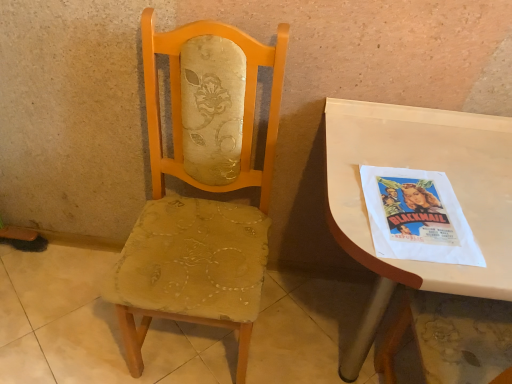
Question: From the image's perspective, is white glossy desk at right positioned above or below worn fabric chair at center?

Choices:
 (A) below
 (B) above

Answer: (B)

Question: Considering the positions of point (482, 268) and point (95, 377), is point (482, 268) closer or farther from the camera than point (95, 377)?

Choices:
 (A) farther
 (B) closer

Answer: (B)

Question: Considering the real-world distances, which object is farthest from the matte yellow fabric chair at center?

Choices:
 (A) worn fabric chair at center
 (B) white paper poster at right
 (C) white glossy desk at right

Answer: (A)

Question: Which is farther from the white glossy desk at right?

Choices:
 (A) white paper poster at right
 (B) worn fabric chair at center
 (C) matte yellow fabric chair at center

Answer: (B)